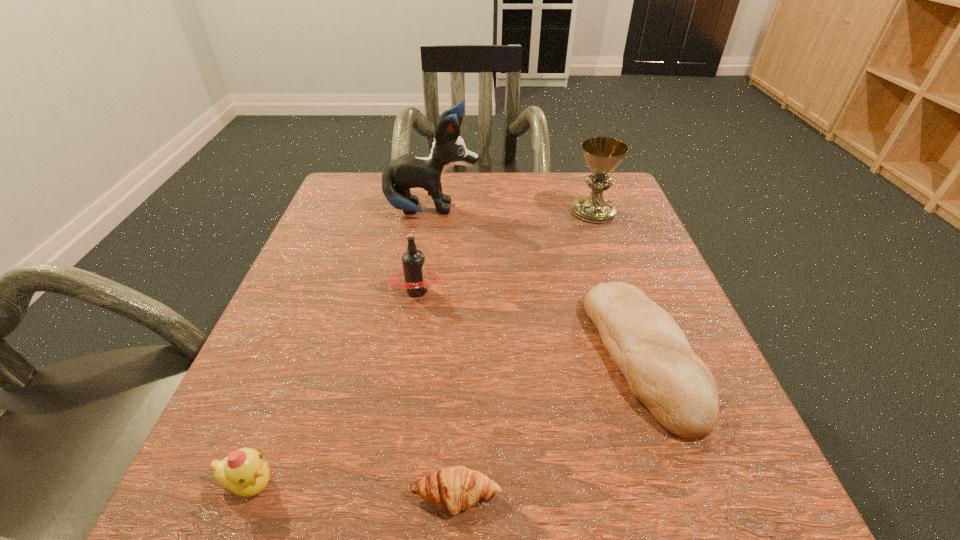
This screenshot has height=540, width=960. I want to click on puppy, so click(408, 171).

Find the location of a particular element. This screenshot has height=540, width=960. the second tallest object is located at coordinates (602, 154).

Where is `root beer`? This screenshot has width=960, height=540. root beer is located at coordinates (414, 270).

Identify the location of the third shortest object. (244, 472).

The width and height of the screenshot is (960, 540). What are the coordinates of `duckling` in the screenshot? It's located at pos(244,472).

This screenshot has width=960, height=540. I want to click on the second shortest object, so click(x=652, y=352).

The image size is (960, 540). I want to click on pastry, so click(x=455, y=488).

Where is `free location located on the front-facing side of the puppy`? free location located on the front-facing side of the puppy is located at coordinates (501, 211).

Identify the location of free point located 0.340m on the front of the fifth shortest object. This screenshot has width=960, height=540. (640, 341).

Image resolution: width=960 pixels, height=540 pixels. I want to click on vacant region located on the label of the root beer, so click(x=584, y=291).